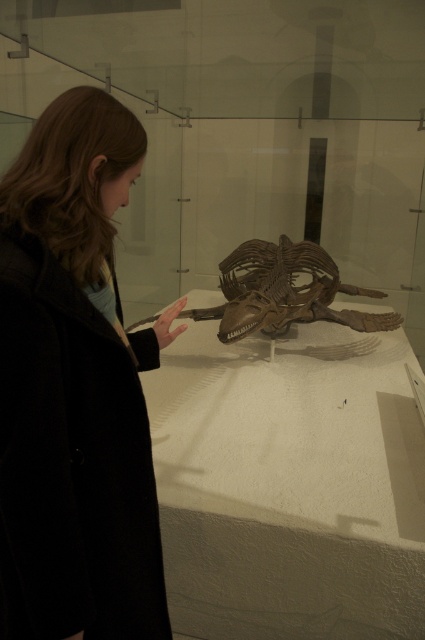
From the picture: You are a security guard in the museum and need to monitor the black wool coat at left. Where should you position yourself to have a clear view of it?

To monitor the black wool coat at left effectively, position yourself at a point opposite to its coordinates, which is approximately at point (348, 252). This position allows for a clear line of sight and optimal surveillance.

You are a museum visitor who wants to take a photo of the brown wooden skeleton at center without the black wool coat at left appearing in the shot. Based on their positions, is this possible?

The black wool coat at left is in front of the brown wooden skeleton at center, so taking a photo of the brown wooden skeleton at center without the black wool coat at left would require moving around the display to avoid the obstruction.